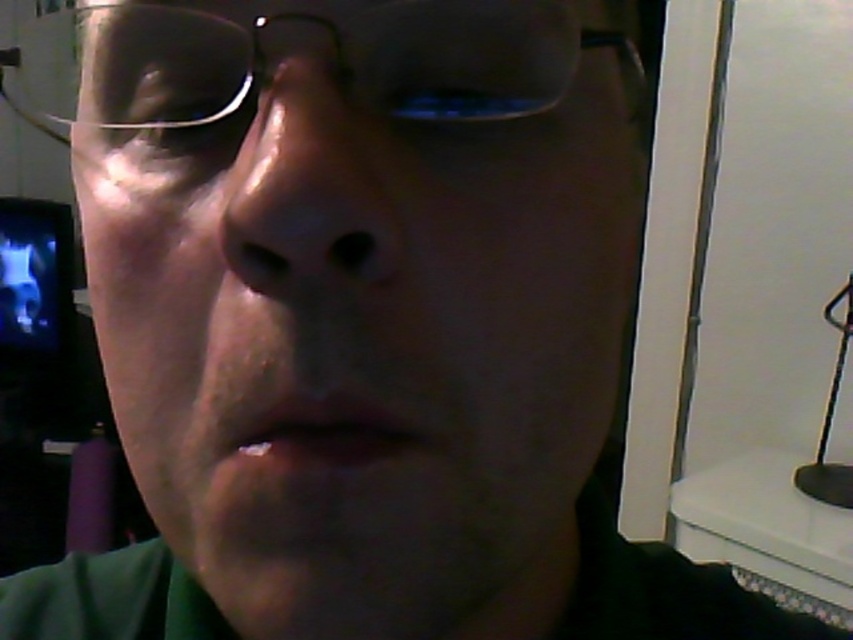
Which is in front, point (280, 51) or point (241, 253)?

Point (241, 253)

Between point (193, 48) and point (315, 257), which one is positioned behind?

The point (193, 48) is behind.

This screenshot has width=853, height=640. Find the location of `clear plastic glasses at upper center`. clear plastic glasses at upper center is located at coordinates (300, 52).

Between green matte face at center and clear plastic glasses at upper center, which one appears on the right side from the viewer's perspective?

green matte face at center is more to the right.

Does green matte face at center have a lesser width compared to clear plastic glasses at upper center?

Correct, green matte face at center's width is less than clear plastic glasses at upper center's.

Describe the element at coordinates (366, 346) in the screenshot. The image size is (853, 640). I see `green matte face at center` at that location.

Identify the location of green matte face at center. Image resolution: width=853 pixels, height=640 pixels. (366, 346).

Does green matte face at center appear on the left side of smooth skin nose at center?

In fact, green matte face at center is to the right of smooth skin nose at center.

Is green matte face at center in front of smooth skin nose at center?

Yes, it is in front of smooth skin nose at center.

Describe the element at coordinates (366, 346) in the screenshot. I see `green matte face at center` at that location.

The image size is (853, 640). Identify the location of green matte face at center. (366, 346).